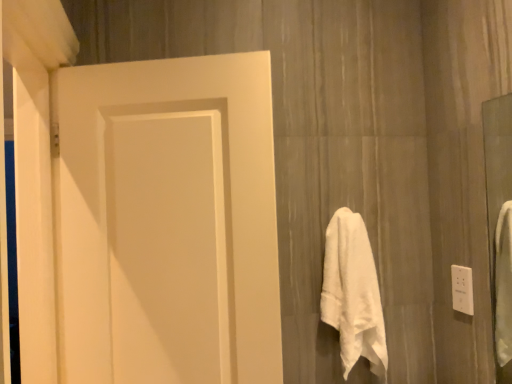
Question: From a real-world perspective, is matte white door at left physically above white plastic outlet at right?

Choices:
 (A) no
 (B) yes

Answer: (B)

Question: Is matte white door at left facing away from white plastic outlet at right?

Choices:
 (A) no
 (B) yes

Answer: (A)

Question: Is matte white door at left at the right side of white plastic outlet at right?

Choices:
 (A) yes
 (B) no

Answer: (B)

Question: Considering the relative sizes of matte white door at left and white plastic outlet at right in the image provided, is matte white door at left thinner than white plastic outlet at right?

Choices:
 (A) no
 (B) yes

Answer: (A)

Question: Considering the relative sizes of matte white door at left and white plastic outlet at right in the image provided, is matte white door at left wider than white plastic outlet at right?

Choices:
 (A) yes
 (B) no

Answer: (A)

Question: Is matte white door at left closer to the viewer compared to white plastic outlet at right?

Choices:
 (A) no
 (B) yes

Answer: (B)

Question: Is white plastic outlet at right positioned in front of white soft towel at center-right?

Choices:
 (A) no
 (B) yes

Answer: (A)

Question: Is white plastic outlet at right far away from white soft towel at center-right?

Choices:
 (A) no
 (B) yes

Answer: (A)

Question: Is white plastic outlet at right placed right next to white soft towel at center-right?

Choices:
 (A) no
 (B) yes

Answer: (A)

Question: Does white plastic outlet at right have a lesser height compared to white soft towel at center-right?

Choices:
 (A) yes
 (B) no

Answer: (A)

Question: Is white soft towel at center-right completely or partially inside white plastic outlet at right?

Choices:
 (A) yes
 (B) no

Answer: (B)

Question: Does white plastic outlet at right appear on the left side of white soft towel at center-right?

Choices:
 (A) no
 (B) yes

Answer: (A)

Question: From the image's perspective, is white soft towel at center-right on white plastic outlet at right?

Choices:
 (A) no
 (B) yes

Answer: (A)